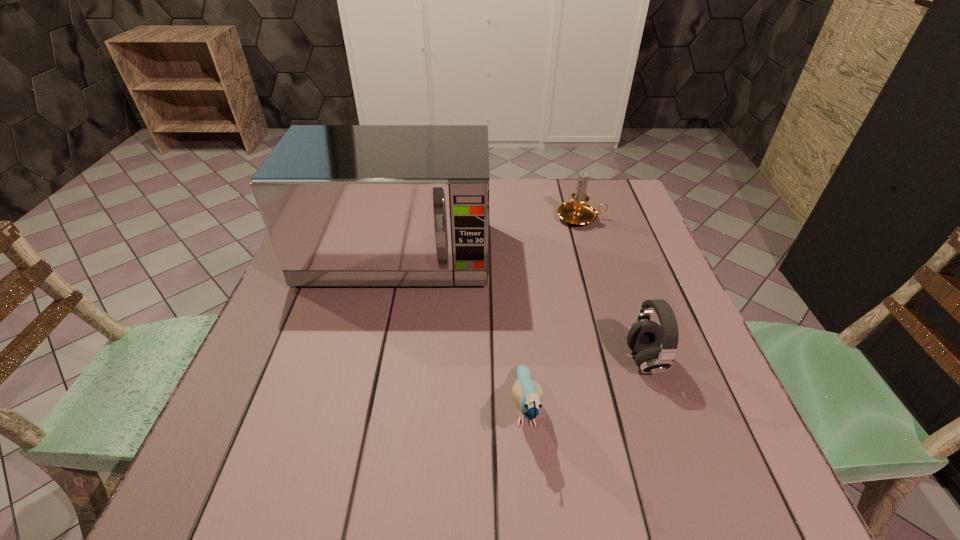
The height and width of the screenshot is (540, 960). What are the coordinates of `the tallest object` in the screenshot? It's located at (344, 205).

Find the location of `microwave oven`. microwave oven is located at coordinates (344, 205).

The height and width of the screenshot is (540, 960). What are the coordinates of `candle` in the screenshot? It's located at (578, 213).

You are a GUI agent. You are given a task and a screenshot of the screen. Output one action in this format:
    pyautogui.click(x=<x>, y=<y>)
    Task: Click on the headset
    
    Given the screenshot: What is the action you would take?
    pyautogui.click(x=644, y=337)

This screenshot has height=540, width=960. Find the location of `bird`. bird is located at coordinates (528, 394).

The image size is (960, 540). Identify the location of vacant space located with the door open on the leftmost object. (358, 425).

The height and width of the screenshot is (540, 960). I want to click on vacant position located on the left of the candle, so click(x=479, y=218).

Identify the location of free point located 0.270m on the ear cups of the headset. The height and width of the screenshot is (540, 960). (491, 360).

Locate an element on the screen. free space located 0.080m on the ear cups of the headset is located at coordinates (586, 360).

You are a GUI agent. You are given a task and a screenshot of the screen. Output one action in this format:
    pyautogui.click(x=<x>, y=<y>)
    Task: Click on the vacant space located on the ear cups of the headset
    The height and width of the screenshot is (540, 960).
    Given the screenshot: What is the action you would take?
    pyautogui.click(x=566, y=360)